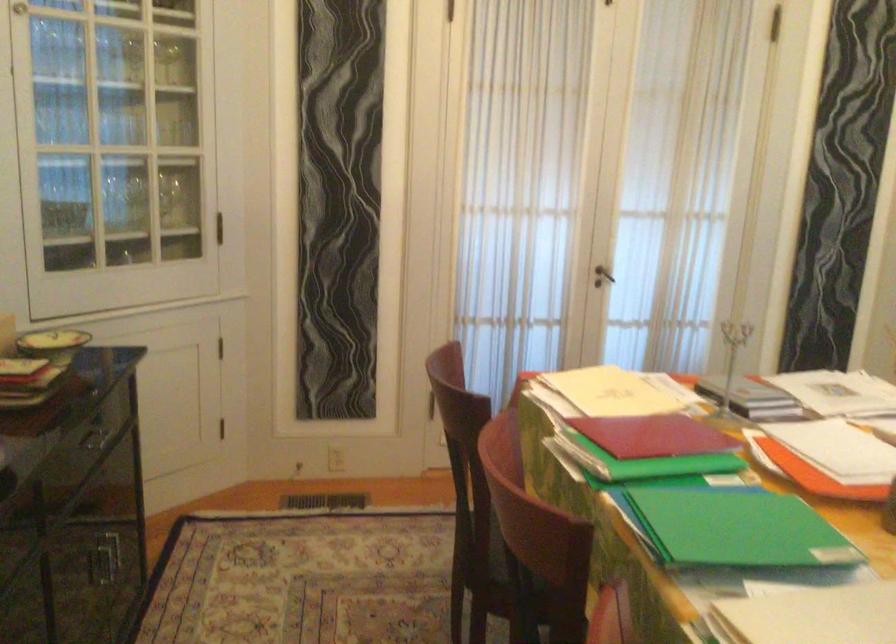
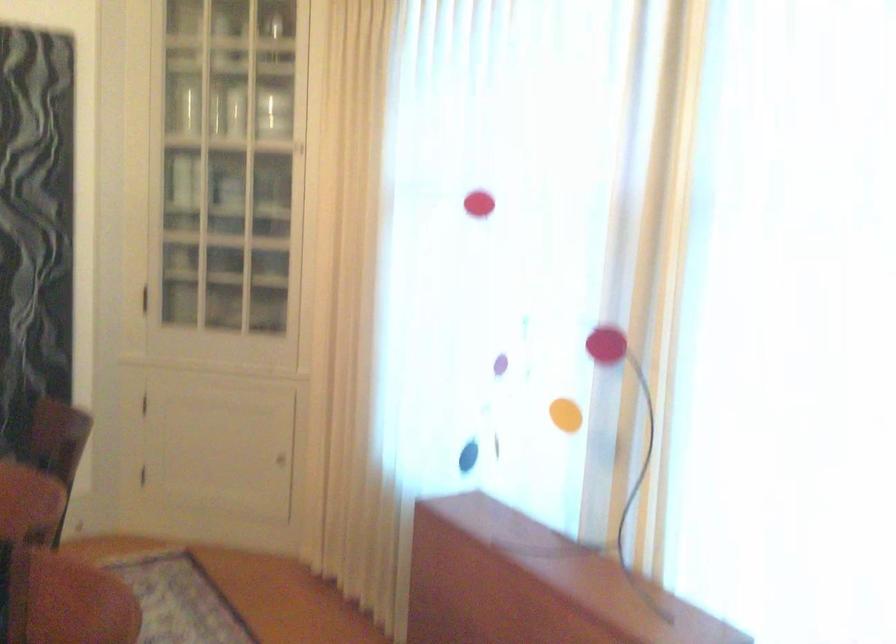
Question: What movement of the cameraman would produce the second image?

Choices:
 (A) Left
 (B) Right
 (C) Forward
 (D) Backward

Answer: (B)